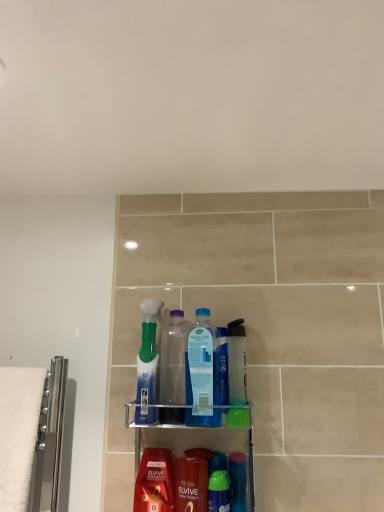
Question: Which direction should I rotate to look at translucent plastic bottle at center, which appears as the fourth mouthwash when viewed from the left, — up or down?

Choices:
 (A) down
 (B) up

Answer: (A)

Question: Is transparent plastic bottle at center, which ranks as the second bottle in left-to-right order, far away from green plastic mouthwash at center, which appears as the 2th mouthwash when viewed from the left?

Choices:
 (A) no
 (B) yes

Answer: (A)

Question: Does transparent plastic bottle at center, the second bottle viewed from the right, appear on the right side of green plastic mouthwash at center, which appears as the 2th mouthwash when viewed from the left?

Choices:
 (A) no
 (B) yes

Answer: (A)

Question: Is transparent plastic bottle at center, the second bottle viewed from the right, behind green plastic mouthwash at center, acting as the third mouthwash starting from the right?

Choices:
 (A) yes
 (B) no

Answer: (A)

Question: From the image's perspective, is transparent plastic bottle at center, the second bottle viewed from the right, on green plastic mouthwash at center, which appears as the 2th mouthwash when viewed from the left?

Choices:
 (A) no
 (B) yes

Answer: (B)

Question: Considering the relative sizes of transparent plastic bottle at center, the second bottle viewed from the right, and green plastic mouthwash at center, which appears as the 2th mouthwash when viewed from the left, in the image provided, is transparent plastic bottle at center, the second bottle viewed from the right, bigger than green plastic mouthwash at center, which appears as the 2th mouthwash when viewed from the left,?

Choices:
 (A) yes
 (B) no

Answer: (A)

Question: Does transparent plastic bottle at center, which ranks as the second bottle in left-to-right order, touch green plastic mouthwash at center, acting as the third mouthwash starting from the right?

Choices:
 (A) yes
 (B) no

Answer: (B)

Question: Would you consider translucent plastic bottle at center, which appears as the fourth mouthwash when viewed from the left, to be distant from translucent plastic bottles at center?

Choices:
 (A) yes
 (B) no

Answer: (B)

Question: Is translucent plastic bottle at center, which appears as the fourth mouthwash when viewed from the left, wider than translucent plastic bottles at center?

Choices:
 (A) yes
 (B) no

Answer: (B)

Question: Considering the relative positions of translucent plastic bottle at center, which appears as the fourth mouthwash when viewed from the left, and translucent plastic bottles at center in the image provided, is translucent plastic bottle at center, which appears as the fourth mouthwash when viewed from the left, in front of translucent plastic bottles at center?

Choices:
 (A) yes
 (B) no

Answer: (B)

Question: Considering the relative positions of translucent plastic bottle at center, which is the first mouthwash from right to left, and translucent plastic bottles at center in the image provided, is translucent plastic bottle at center, which is the first mouthwash from right to left, to the left of translucent plastic bottles at center from the viewer's perspective?

Choices:
 (A) yes
 (B) no

Answer: (B)

Question: Is translucent plastic bottle at center, which is the first mouthwash from right to left, taller than translucent plastic bottles at center?

Choices:
 (A) yes
 (B) no

Answer: (B)

Question: From a real-world perspective, does translucent plastic bottle at center, which appears as the fourth mouthwash when viewed from the left, stand above translucent plastic bottles at center?

Choices:
 (A) no
 (B) yes

Answer: (B)

Question: From the image's perspective, is shiny red shampoo at lower center below translucent plastic bottle at center, which appears as the fourth mouthwash when viewed from the left?

Choices:
 (A) yes
 (B) no

Answer: (A)